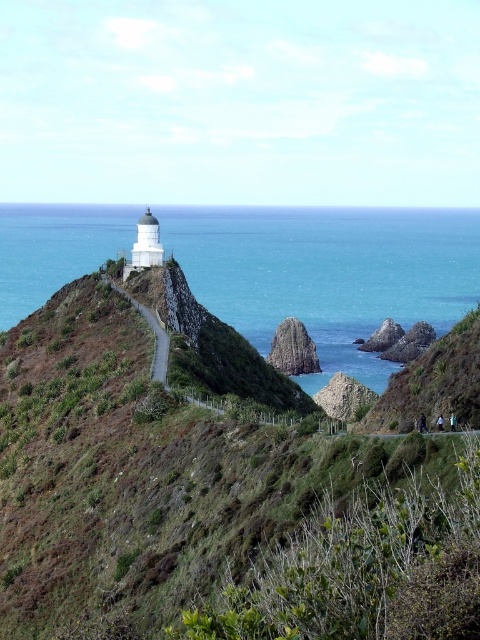
You are a hiker planning to climb the green grassy hillside at upper left and then descend to the blue water at upper center. Based on the scene, which part of the terrain will require more effort due to elevation changes?

The blue water at upper center has a greater height than the green grassy hillside at upper left, so descending to the blue water at upper center will require more effort due to the elevation difference.

You are standing at the base of the coastal promontory and want to reach the lighthouse. There is a green grassy hillside at upper left. Can you see the lighthouse from your current position, and which direction should you head to reach it?

The green grassy hillside at upper left is located at point (211, 502), which is to the upper left of the image. Since the lighthouse is situated atop the rocky promontory, you can likely see it from your current position. To reach the lighthouse, you should head towards the upper right direction, away from the green grassy hillside at upper left, following the winding pathway bordered by low wooden railings.